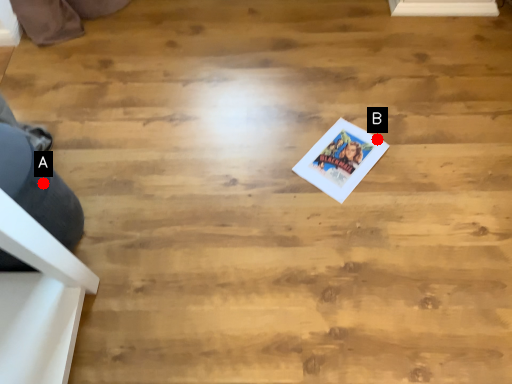
Question: Two points are circled on the image, labeled by A and B beside each circle. Which point is farther to the camera?

Choices:
 (A) A is further
 (B) B is further

Answer: (B)